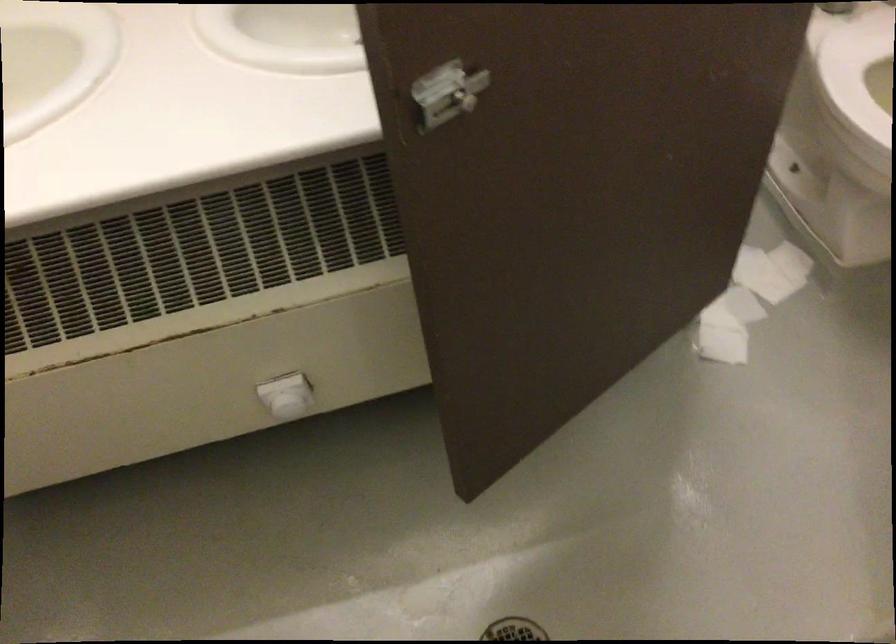
I want to click on stall door latch, so click(x=448, y=91).